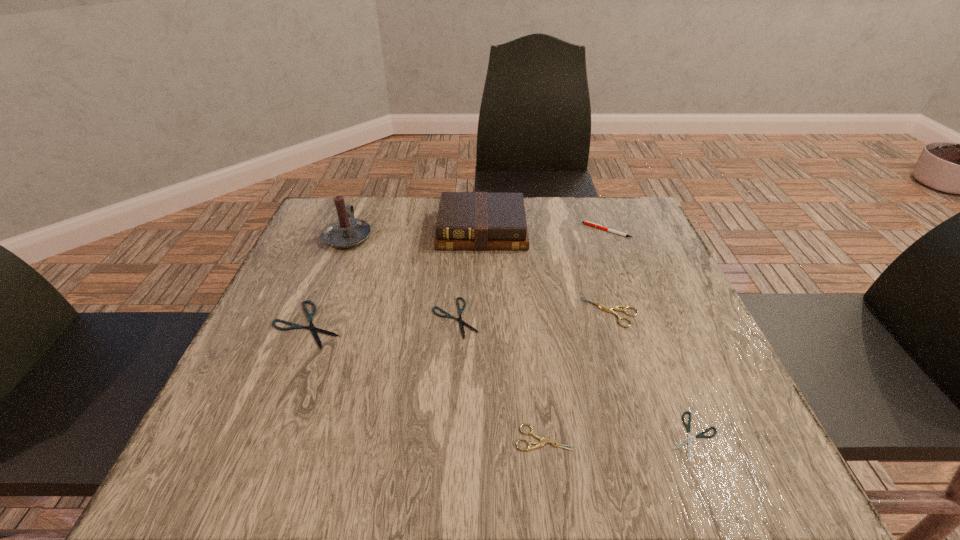
Identify the location of vacant area at the far right corner. (597, 197).

Where is `free spot between the rightmost black shears and the second black shears from right to left`? This screenshot has height=540, width=960. free spot between the rightmost black shears and the second black shears from right to left is located at coordinates (574, 376).

This screenshot has height=540, width=960. In order to click on free spot between the right beige shears and the third tallest object in this screenshot , I will do `click(609, 271)`.

Where is `vacant area that lies between the bigger beige shears and the Bible`? The image size is (960, 540). vacant area that lies between the bigger beige shears and the Bible is located at coordinates (546, 271).

In order to click on free space between the smaller beige shears and the seventh shortest object in this screenshot , I will do `click(513, 334)`.

Identify the location of empty location between the shortest object and the left beige shears. (618, 436).

Locate an element on the screen. This screenshot has height=540, width=960. empty space between the seventh shortest object and the fifth shortest object is located at coordinates (546, 271).

Find the location of a particular element. blank region between the shortest shears and the right beige shears is located at coordinates (652, 374).

Where is `unoccupied position between the leftmost black shears and the rightmost black shears`? The image size is (960, 540). unoccupied position between the leftmost black shears and the rightmost black shears is located at coordinates (500, 380).

Choose which object is the seventh nearest neighbor to the nearest black shears. Please provide its 2D coordinates. Your answer should be formatted as a tuple, i.e. [(x, y)], where the tuple contains the x and y coordinates of a point satisfying the conditions above.

[(345, 232)]